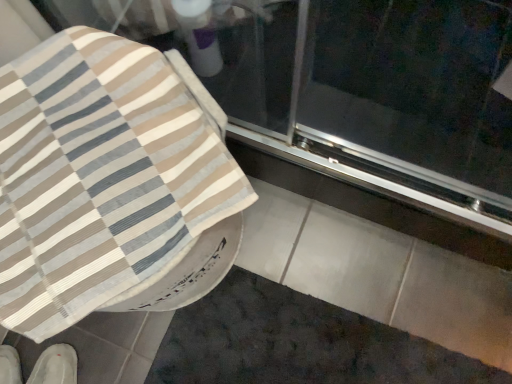
Question: Is beige striped fabric at upper left to the right of white fabric shoe at lower left, which is the first footwear in left-to-right order, from the viewer's perspective?

Choices:
 (A) yes
 (B) no

Answer: (A)

Question: Is beige striped fabric at upper left oriented towards white fabric shoe at lower left, the 2th footwear in the right-to-left sequence?

Choices:
 (A) no
 (B) yes

Answer: (A)

Question: Is beige striped fabric at upper left touching white fabric shoe at lower left, which is the first footwear in left-to-right order?

Choices:
 (A) no
 (B) yes

Answer: (A)

Question: Is beige striped fabric at upper left at the left side of white fabric shoe at lower left, the 2th footwear in the right-to-left sequence?

Choices:
 (A) yes
 (B) no

Answer: (B)

Question: From the image's perspective, does beige striped fabric at upper left appear lower than white fabric shoe at lower left, which is the first footwear in left-to-right order?

Choices:
 (A) no
 (B) yes

Answer: (A)

Question: In terms of size, does white fabric slipper at lower left, the 2th footwear from the left, appear bigger or smaller than beige striped fabric at upper left?

Choices:
 (A) big
 (B) small

Answer: (B)

Question: From a real-world perspective, is white fabric slipper at lower left, which is the 1th footwear in right-to-left order, positioned above or below beige striped fabric at upper left?

Choices:
 (A) above
 (B) below

Answer: (B)

Question: In the image, is white fabric slipper at lower left, the 2th footwear from the left, positioned in front of or behind beige striped fabric at upper left?

Choices:
 (A) behind
 (B) front

Answer: (A)

Question: In the image, is white fabric slipper at lower left, which is the 1th footwear in right-to-left order, on the left side or the right side of beige striped fabric at upper left?

Choices:
 (A) left
 (B) right

Answer: (A)

Question: From a real-world perspective, is dark gray textured bath mat at lower center above or below white fabric slipper at lower left, which is the 1th footwear in right-to-left order?

Choices:
 (A) above
 (B) below

Answer: (B)

Question: From the image's perspective, relative to white fabric slipper at lower left, which is the 1th footwear in right-to-left order, is dark gray textured bath mat at lower center above or below?

Choices:
 (A) above
 (B) below

Answer: (A)

Question: Considering the relative positions of dark gray textured bath mat at lower center and white fabric slipper at lower left, the 2th footwear from the left, in the image provided, is dark gray textured bath mat at lower center to the left or to the right of white fabric slipper at lower left, the 2th footwear from the left,?

Choices:
 (A) right
 (B) left

Answer: (A)

Question: From their relative heights in the image, would you say dark gray textured bath mat at lower center is taller or shorter than white fabric slipper at lower left, the 2th footwear from the left?

Choices:
 (A) short
 (B) tall

Answer: (A)

Question: Is transparent glass screen door at upper center taller or shorter than white fabric slipper at lower left, the 2th footwear from the left?

Choices:
 (A) short
 (B) tall

Answer: (A)

Question: Is transparent glass screen door at upper center to the left or to the right of white fabric slipper at lower left, which is the 1th footwear in right-to-left order, in the image?

Choices:
 (A) right
 (B) left

Answer: (A)